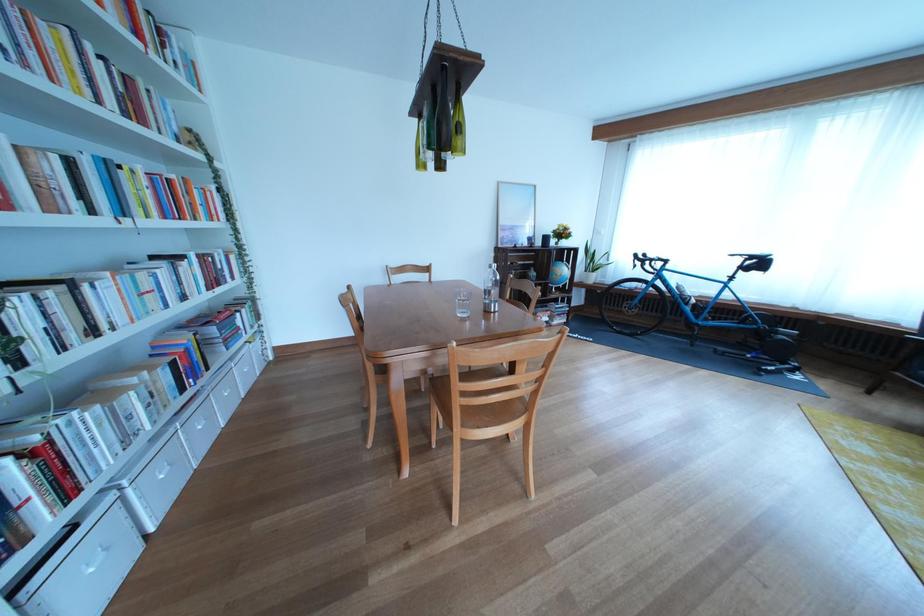
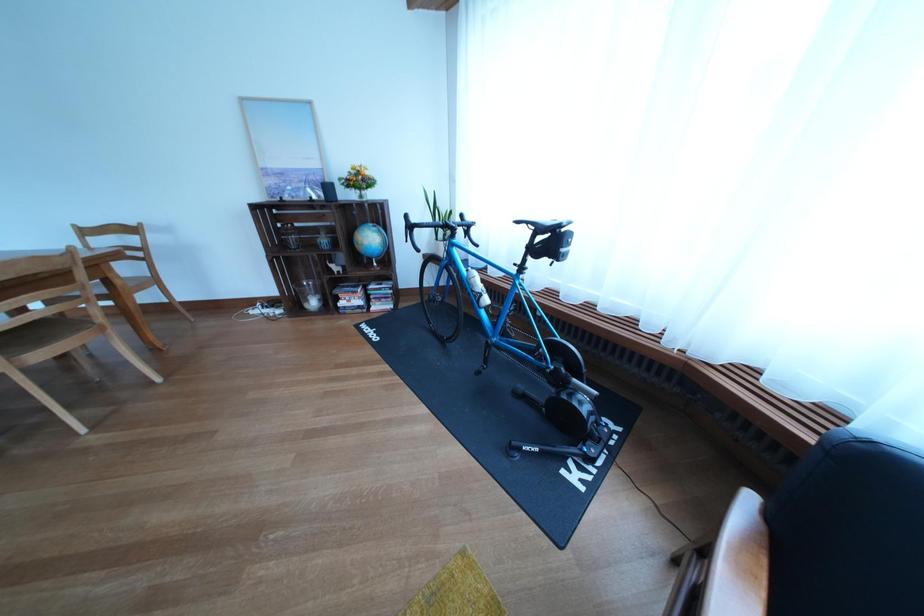
Locate, in the second image, the point that corresponds to pixel 575 238 in the first image.

(372, 185)